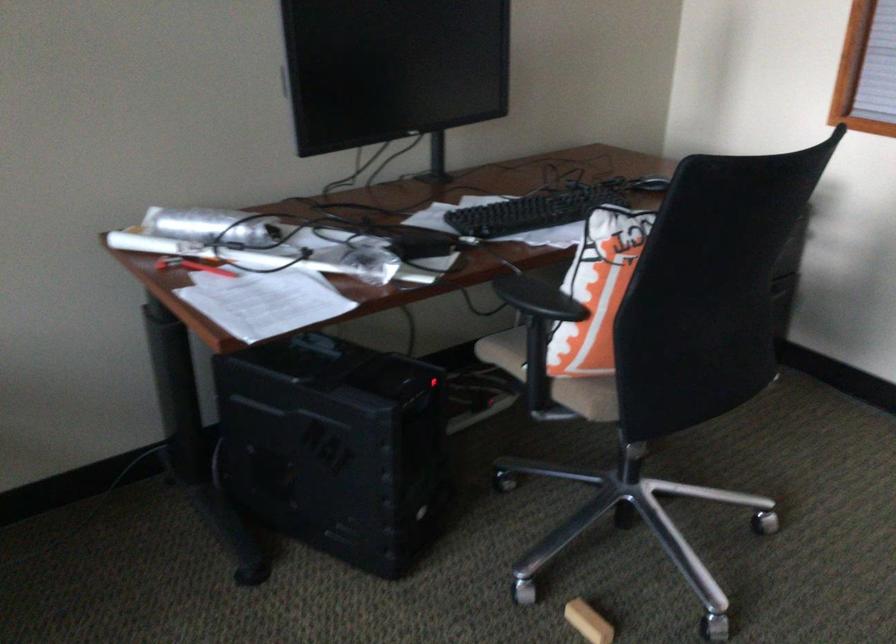
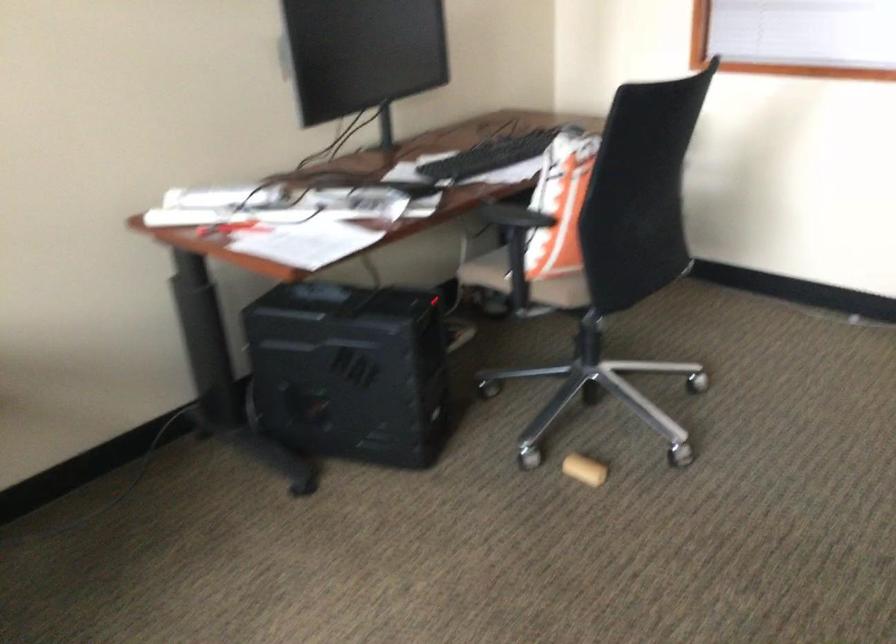
Question: The camera is either moving clockwise (left) or counter-clockwise (right) around the object. The first image is from the beginning of the video and the second image is from the end. Is the camera moving left or right when shooting the video?

Choices:
 (A) Left
 (B) Right

Answer: (A)